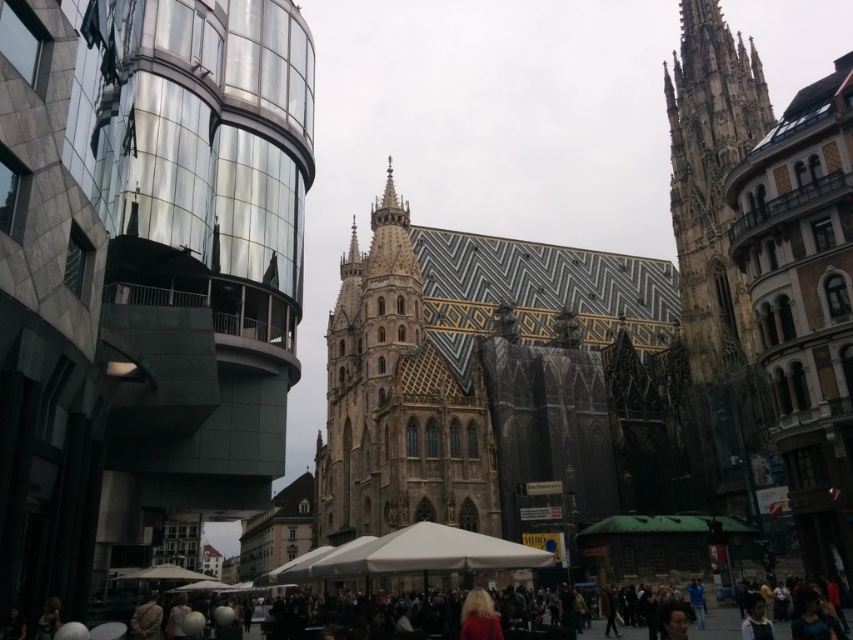
From the picture: You are a tourist standing in front of the historic cathedral. You notice a brown stone tower at right and a dark brown leather jacket at lower center. Which object is taller?

The brown stone tower at right is taller than the dark brown leather jacket at lower center.

You are an architect visiting the city and want to compare the sizes of the golden mosaic tiles at center and the dark brown leather jacket at lower center. Which object is bigger?

The golden mosaic tiles at center has a larger size compared to the dark brown leather jacket at lower center, so the golden mosaic tiles at center is bigger.

You are standing in the bustling urban scene with the historic cathedral and modern building. There is a point marked at coordinates point (143, 273). Which object does this point correspond to?

The point (143, 273) corresponds to the golden mosaic church at center.